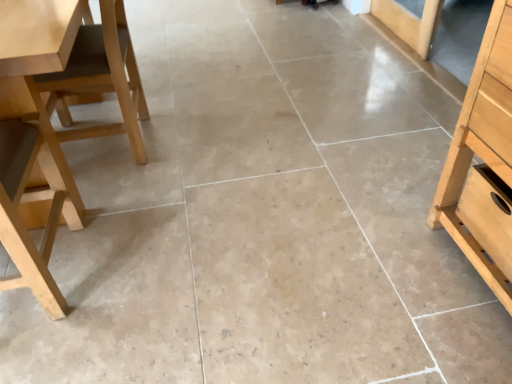
The height and width of the screenshot is (384, 512). Find the location of `light wood drawer at right`. light wood drawer at right is located at coordinates (488, 214).

Relative to light wood drawer at right, is light wood chair at left, the first chair when ordered from front to back, in front or behind?

In the image, light wood chair at left, the first chair when ordered from front to back, appears in front of light wood drawer at right.

From the picture: From the image's perspective, who appears lower, light wood chair at left, which is counted as the second chair, starting from the back, or light wood drawer at right?

From the image's view, light wood drawer at right is below.

Is light wood chair at left, which is counted as the second chair, starting from the back, wider than light wood drawer at right?

Correct, the width of light wood chair at left, which is counted as the second chair, starting from the back, exceeds that of light wood drawer at right.

Is light wood chair at left, which is counted as the second chair, starting from the back, completely or partially outside of light wood drawer at right?

light wood chair at left, which is counted as the second chair, starting from the back, is positioned outside light wood drawer at right.

You are a GUI agent. You are given a task and a screenshot of the screen. Output one action in this format:
    pyautogui.click(x=<x>, y=<y>)
    Task: Click on the table directly beneath the light wood chair at left, which is counted as the second chair, starting from the back (from a real-world perspective)
    
    Given the screenshot: What is the action you would take?
    pyautogui.click(x=34, y=85)

From a real-world perspective, between light wood chair at left, the first chair when ordered from front to back, and light wood table at left, who is vertically lower?

In real-world perspective, light wood table at left is lower.

How much distance is there between light wood chair at left, which is counted as the second chair, starting from the back, and light wood table at left?

The distance of light wood chair at left, which is counted as the second chair, starting from the back, from light wood table at left is 5.67 inches.

Can you confirm if light wood chair at left, the first chair when ordered from front to back, is smaller than light wood table at left?

No.

Is light wood chair at left, the first chair when ordered from front to back, inside the boundaries of light brown wood chair at left, acting as the first chair starting from the back, or outside?

light wood chair at left, the first chair when ordered from front to back, is spatially situated outside light brown wood chair at left, acting as the first chair starting from the back.

Which object is wider, light wood chair at left, which is counted as the second chair, starting from the back, or light brown wood chair at left, acting as the first chair starting from the back?

light wood chair at left, which is counted as the second chair, starting from the back, is wider.

This screenshot has height=384, width=512. In order to click on chair below the light wood chair at left, which is counted as the second chair, starting from the back (from a real-world perspective) in this screenshot , I will do `click(101, 77)`.

In terms of height, does light brown wood chair at left, acting as the first chair starting from the back, look taller or shorter compared to light wood chair at left, the first chair when ordered from front to back?

Clearly, light brown wood chair at left, acting as the first chair starting from the back, is shorter compared to light wood chair at left, the first chair when ordered from front to back.

From the image's perspective, is light brown wood chair at left, the 2th chair in the front-to-back sequence, on light wood chair at left, the first chair when ordered from front to back?

Yes, from the image's perspective, light brown wood chair at left, the 2th chair in the front-to-back sequence, is above light wood chair at left, the first chair when ordered from front to back.

Looking at the image, does light brown wood chair at left, the 2th chair in the front-to-back sequence, seem bigger or smaller compared to light wood chair at left, which is counted as the second chair, starting from the back?

light brown wood chair at left, the 2th chair in the front-to-back sequence, is smaller than light wood chair at left, which is counted as the second chair, starting from the back.

What's the angular difference between light brown wood chair at left, the 2th chair in the front-to-back sequence, and light wood table at left's facing directions?

88.9 degrees separate the facing orientations of light brown wood chair at left, the 2th chair in the front-to-back sequence, and light wood table at left.

Can we say light brown wood chair at left, the 2th chair in the front-to-back sequence, lies outside light wood table at left?

Yes.

Which is in front, light brown wood chair at left, the 2th chair in the front-to-back sequence, or light wood table at left?

light wood table at left.

Is light brown wood chair at left, the 2th chair in the front-to-back sequence, turned away from light wood table at left?

No, light wood table at left is not at the back of light brown wood chair at left, the 2th chair in the front-to-back sequence.

Would you say light wood table at left is inside or outside light wood drawer at right?

light wood table at left is spatially situated outside light wood drawer at right.

Is light wood table at left facing away from light wood drawer at right?

light wood table at left does not have its back to light wood drawer at right.

Is light wood table at left oriented away from light brown wood chair at left, acting as the first chair starting from the back?

No.

In the image, there is a light wood table at left. Where is `chair below it (from a real-world perspective)`? chair below it (from a real-world perspective) is located at coordinates (101, 77).

Would you say light wood table at left is a long distance from light brown wood chair at left, acting as the first chair starting from the back?

They are positioned close to each other.

The width and height of the screenshot is (512, 384). Find the location of `drawer lying below the light wood chair at left, which is counted as the second chair, starting from the back (from the image's perspective)`. drawer lying below the light wood chair at left, which is counted as the second chair, starting from the back (from the image's perspective) is located at coordinates (488, 214).

Find the location of a particular element. Image resolution: width=512 pixels, height=384 pixels. chair positioned vertically above the light wood table at left (from a real-world perspective) is located at coordinates (59, 117).

When comparing their distances from light wood chair at left, which is counted as the second chair, starting from the back, does light wood table at left or light brown wood chair at left, acting as the first chair starting from the back, seem closer?

Based on the image, light brown wood chair at left, acting as the first chair starting from the back, appears to be nearer to light wood chair at left, which is counted as the second chair, starting from the back.

Based on their spatial positions, is light wood table at left or light wood drawer at right further from light wood chair at left, which is counted as the second chair, starting from the back?

light wood drawer at right.

When comparing their distances from light brown wood chair at left, the 2th chair in the front-to-back sequence, does light wood chair at left, the first chair when ordered from front to back, or light wood table at left seem further?

light wood table at left.

In the scene shown: Estimate the real-world distances between objects in this image. Which object is closer to light brown wood chair at left, the 2th chair in the front-to-back sequence, light wood drawer at right or light wood table at left?

light wood table at left.

From the picture: Based on their spatial positions, is light wood table at left or light wood drawer at right further from light brown wood chair at left, the 2th chair in the front-to-back sequence?

light wood drawer at right lies further to light brown wood chair at left, the 2th chair in the front-to-back sequence, than the other object.

When comparing their distances from light wood table at left, does light brown wood chair at left, the 2th chair in the front-to-back sequence, or light wood chair at left, which is counted as the second chair, starting from the back, seem further?

Among the two, light brown wood chair at left, the 2th chair in the front-to-back sequence, is located further to light wood table at left.

When comparing their distances from light wood table at left, does light wood drawer at right or light wood chair at left, the first chair when ordered from front to back, seem closer?

The object closer to light wood table at left is light wood chair at left, the first chair when ordered from front to back.

Considering their positions, is light brown wood chair at left, acting as the first chair starting from the back, positioned further to light wood table at left than light wood drawer at right?

light wood drawer at right is further to light wood table at left.

Locate an element on the screen. table between light wood chair at left, which is counted as the second chair, starting from the back, and light wood drawer at right is located at coordinates (34, 85).

You are a GUI agent. You are given a task and a screenshot of the screen. Output one action in this format:
    pyautogui.click(x=<x>, y=<y>)
    Task: Click on the chair positioned between light wood table at left and light brown wood chair at left, the 2th chair in the front-to-back sequence, from near to far
    
    Given the screenshot: What is the action you would take?
    pyautogui.click(x=59, y=117)

Locate an element on the screen. Image resolution: width=512 pixels, height=384 pixels. chair between light wood table at left and light wood drawer at right is located at coordinates (101, 77).

Identify the location of chair situated between light wood chair at left, which is counted as the second chair, starting from the back, and light wood drawer at right from left to right. (101, 77).